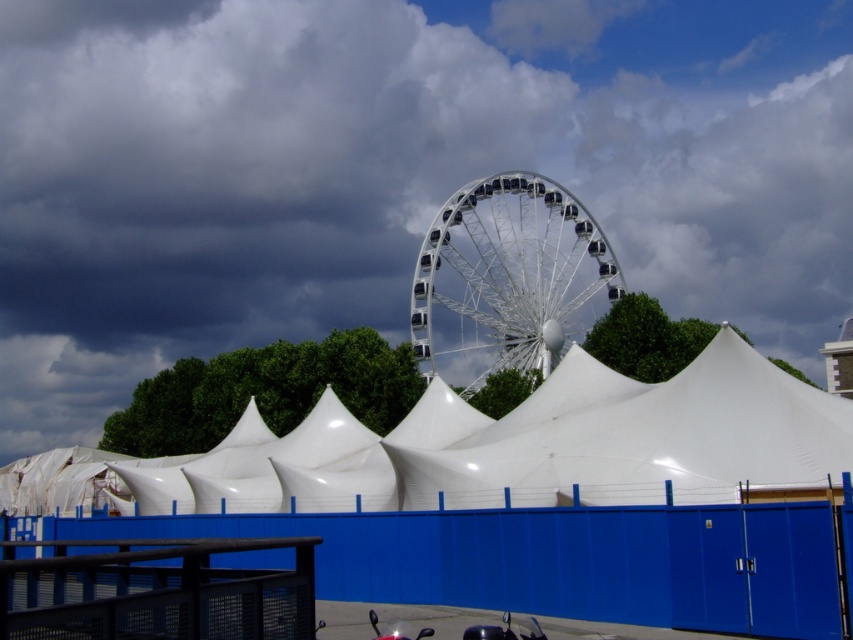
Question: Among these points, which one is farthest from the camera?

Choices:
 (A) (558, 176)
 (B) (572, 280)

Answer: (A)

Question: Is white matte tent at center to the left of white metallic ferris wheel at center from the viewer's perspective?

Choices:
 (A) yes
 (B) no

Answer: (A)

Question: Is white fluffy cloud at upper center above white metallic ferris wheel at center?

Choices:
 (A) no
 (B) yes

Answer: (B)

Question: Considering the real-world distances, which object is closest to the white metallic ferris wheel at center?

Choices:
 (A) white fluffy cloud at upper center
 (B) white matte tent at center

Answer: (A)

Question: Estimate the real-world distances between objects in this image. Which object is closer to the white fluffy cloud at upper center?

Choices:
 (A) white matte tent at center
 (B) white metallic ferris wheel at center

Answer: (B)

Question: Can you confirm if white matte tent at center is smaller than white metallic ferris wheel at center?

Choices:
 (A) no
 (B) yes

Answer: (A)